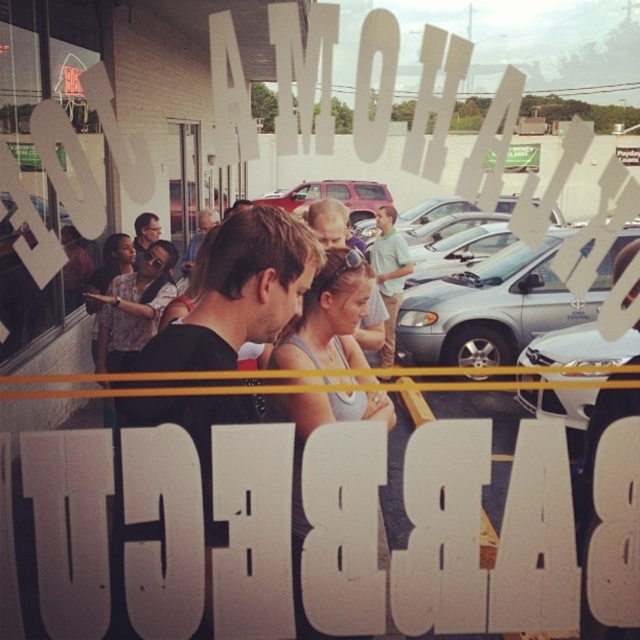
You are a customer waiting in line outside the HOSAMOHABABBA establishment. You notice a transparent glass window at center and a matte gray tank top at center. Which object is located above the other?

The transparent glass window at center is positioned over matte gray tank top at center, so the transparent glass window at center is above the matte gray tank top at center.

You are standing in line at the HOSAMOHABABBA establishment and want to check the menu through the transparent glass window at center. The matte gray tank top at center is blocking your view. Can you estimate if the window is wider than the tank top to see around it?

The transparent glass window at center is narrower than the matte gray tank top at center, so you cannot see around it.

You are a customer trying to see the menu through the transparent glass window at center. However, there is a person wearing a matte gray tank top at center blocking your view. Can you see the menu through the window?

The transparent glass window at center is smaller than the matte gray tank top at center, so the person wearing the matte gray tank top at center is likely blocking your view of the menu through the window.